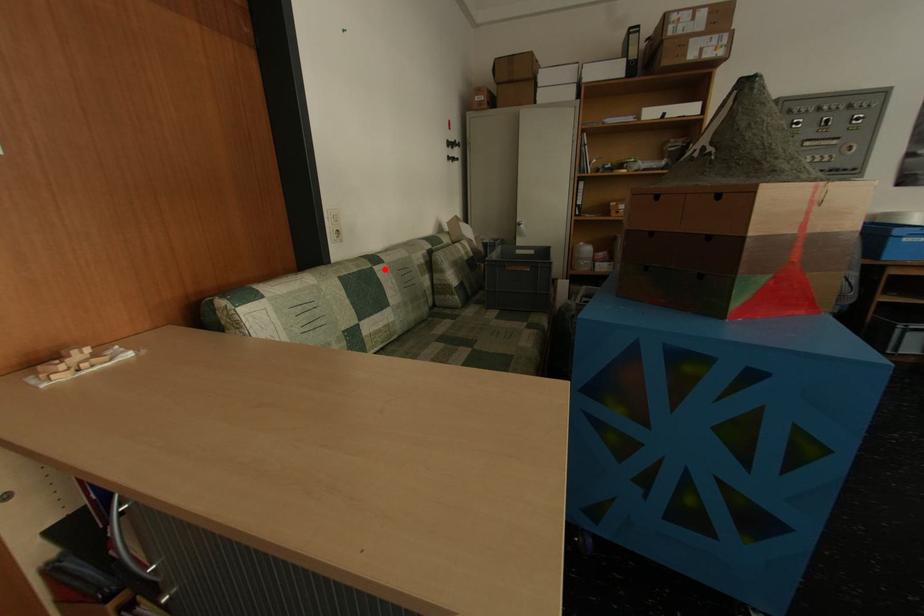
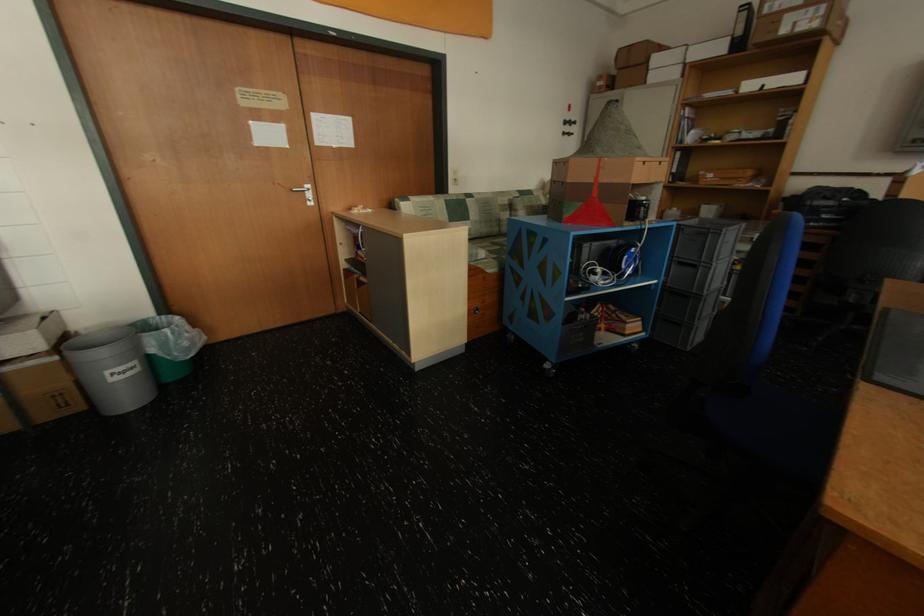
Question: I am providing you with two images of the same scene from different viewpoints. Image1 has a red point marked. In image2, the corresponding 3D location appears at what relative position? Reply with the corresponding letter.

Choices:
 (A) Closer
 (B) Farther

Answer: (A)